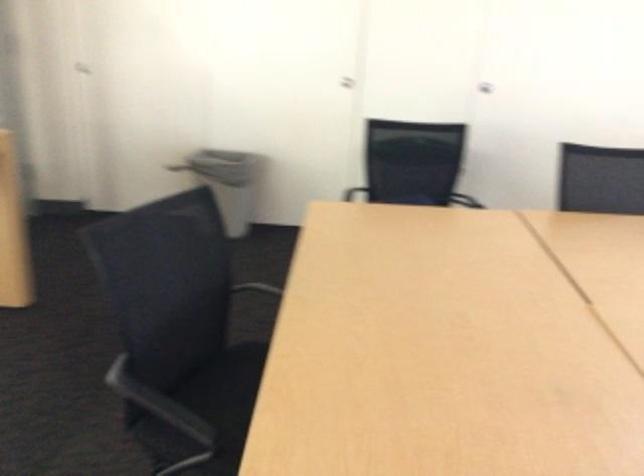
This screenshot has height=476, width=644. In order to click on black chair armrest in this screenshot , I will do click(156, 403).